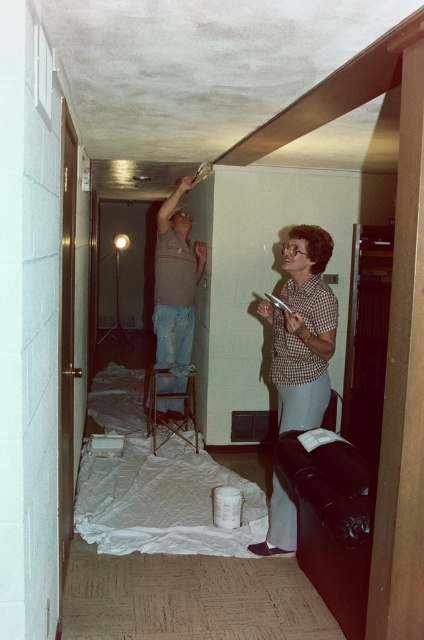
Question: Which object is positioned farthest from the wooden stool at center?

Choices:
 (A) matte brown shirt at upper center
 (B) checkered fabric blouse at center

Answer: (B)

Question: Among these objects, which one is nearest to the camera?

Choices:
 (A) checkered fabric blouse at center
 (B) matte brown shirt at upper center

Answer: (A)

Question: Which of the following is the farthest from the observer?

Choices:
 (A) matte brown shirt at upper center
 (B) checkered fabric blouse at center
 (C) wooden stool at center

Answer: (C)

Question: Does checkered fabric blouse at center appear on the right side of matte brown shirt at upper center?

Choices:
 (A) no
 (B) yes

Answer: (B)

Question: Is checkered fabric blouse at center thinner than wooden stool at center?

Choices:
 (A) yes
 (B) no

Answer: (A)

Question: Does checkered fabric blouse at center have a larger size compared to wooden stool at center?

Choices:
 (A) no
 (B) yes

Answer: (A)